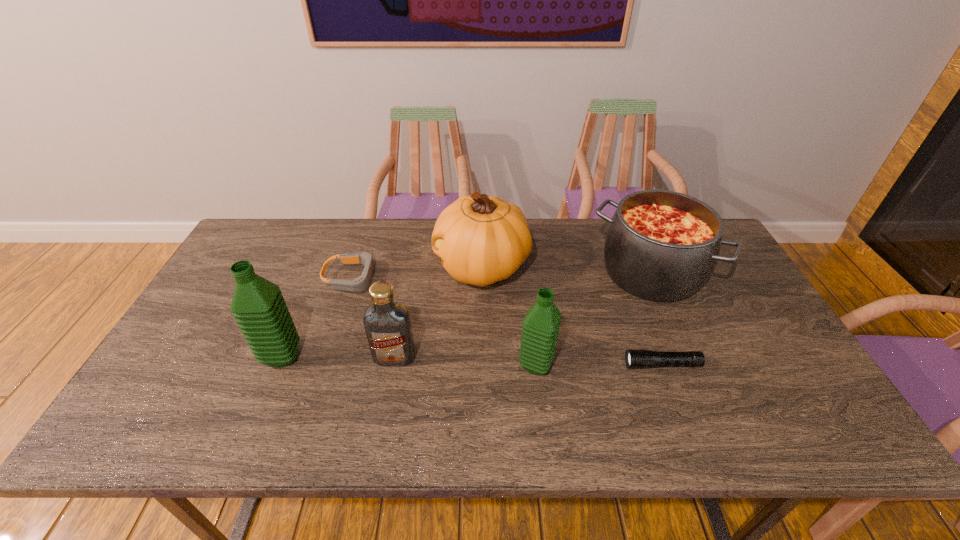
At what (x,y) coordinates should I click in order to perform the action: click on casserole that is at the far edge. Please return your answer as a coordinate pair (x, y). Looking at the image, I should click on point(661,245).

At what (x,y) coordinates should I click in order to perform the action: click on object present at the near edge. Please return your answer as a coordinate pair (x, y). This screenshot has width=960, height=540. Looking at the image, I should click on (541, 325).

This screenshot has height=540, width=960. Identify the location of object that is at the right edge. (661, 245).

I want to click on object that is positioned at the far right corner, so click(x=661, y=245).

You are a GUI agent. You are given a task and a screenshot of the screen. Output one action in this format:
    pyautogui.click(x=<x>, y=<y>)
    Task: Click on the free space at the far edge of the desktop
    The width and height of the screenshot is (960, 540).
    Given the screenshot: What is the action you would take?
    pyautogui.click(x=377, y=233)

Locate an element on the screen. The width and height of the screenshot is (960, 540). blank space at the near edge is located at coordinates (633, 395).

Where is `vacant space at the left edge of the desktop`? This screenshot has height=540, width=960. vacant space at the left edge of the desktop is located at coordinates (202, 313).

Locate an element on the screen. The width and height of the screenshot is (960, 540). free spot at the right edge of the desktop is located at coordinates (725, 266).

In the image, there is a desktop. In order to click on vacant space at the near left corner in this screenshot , I will do `click(201, 377)`.

Where is `unoccupied area between the right water bottle and the casserole`? The width and height of the screenshot is (960, 540). unoccupied area between the right water bottle and the casserole is located at coordinates (593, 319).